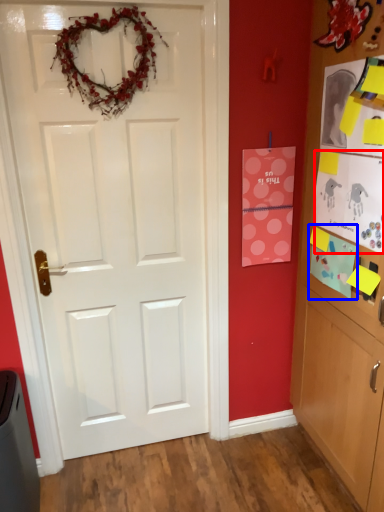
Question: Which object appears farthest to the camera in this image, postcard (highlighted by a red box) or postcard (highlighted by a blue box)?

Choices:
 (A) postcard
 (B) postcard

Answer: (B)